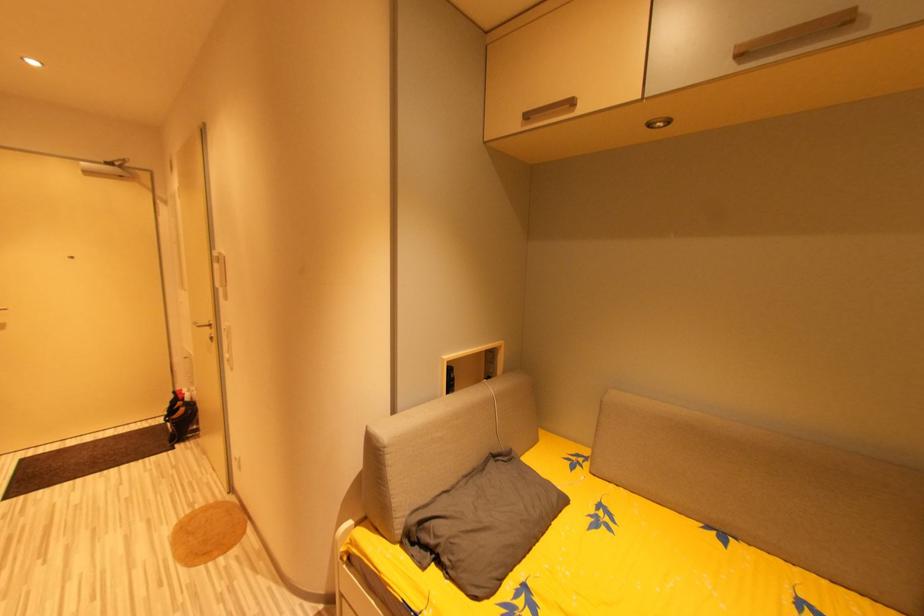
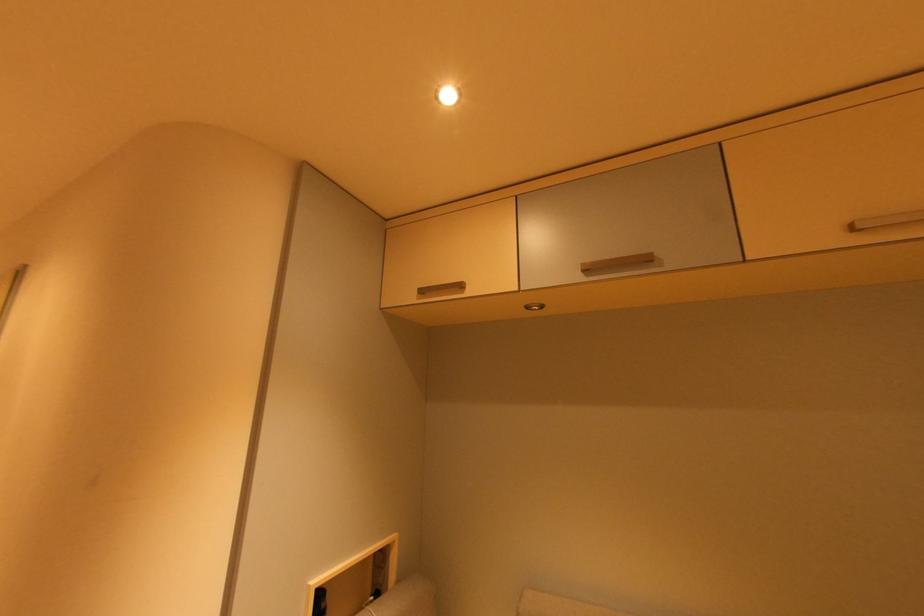
Which direction would the cameraman need to move to produce the second image?

The cameraman moved toward right, forward.